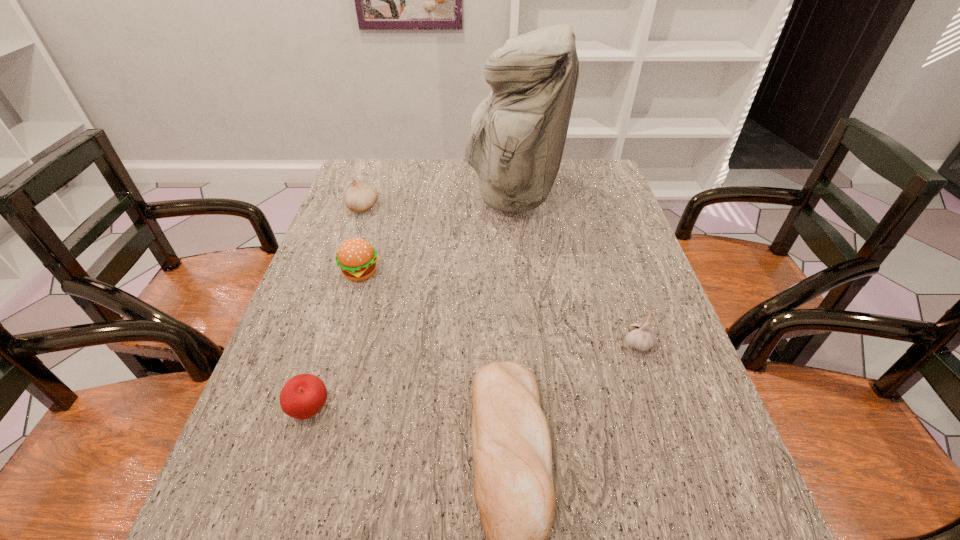
Locate an element on the screen. free space at the right edge of the desktop is located at coordinates (618, 367).

Image resolution: width=960 pixels, height=540 pixels. What are the coordinates of `free spot at the far right corner of the desktop` in the screenshot? It's located at (572, 188).

Identify the location of free spot between the hamburger and the tallest object. This screenshot has height=540, width=960. (437, 234).

Where is `free space between the right garlic and the backpack`? Image resolution: width=960 pixels, height=540 pixels. free space between the right garlic and the backpack is located at coordinates (575, 270).

In order to click on empty space that is in between the taller garlic and the backpack in this screenshot , I will do `click(438, 201)`.

Find the location of `the fifth closest object relative to the farther garlic`. the fifth closest object relative to the farther garlic is located at coordinates (640, 336).

Where is `object identified as the second closest to the apple`? The width and height of the screenshot is (960, 540). object identified as the second closest to the apple is located at coordinates (357, 259).

The height and width of the screenshot is (540, 960). I want to click on vacant space that satisfies the following two spatial constraints: 1. on the front-facing side of the right garlic; 2. on the right side of the backpack, so click(527, 344).